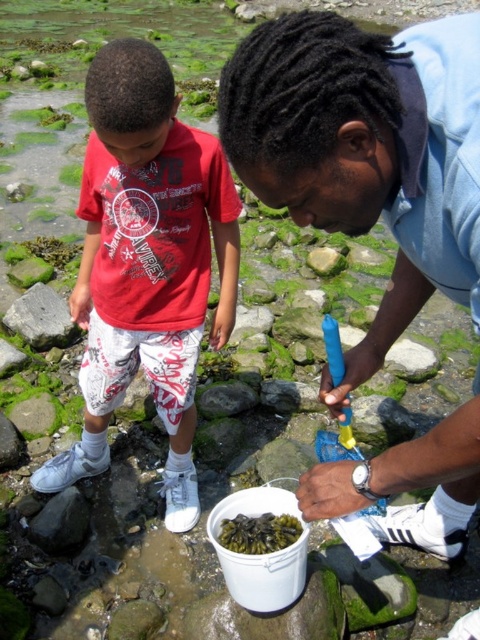
Is point (135, 186) behind point (224, 528)?

Yes, it is behind point (224, 528).

Between matte red t-shirt at left and green seaweed at lower center, which one has more height?

Standing taller between the two is matte red t-shirt at left.

What do you see at coordinates (146, 264) in the screenshot? This screenshot has height=640, width=480. I see `matte red t-shirt at left` at bounding box center [146, 264].

You are a GUI agent. You are given a task and a screenshot of the screen. Output one action in this format:
    pyautogui.click(x=<x>, y=<y>)
    Task: Click on the matte red t-shirt at left
    The width and height of the screenshot is (480, 640).
    Given the screenshot: What is the action you would take?
    pyautogui.click(x=146, y=264)

Is point (439, 180) farther from camera compared to point (269, 545)?

No, (439, 180) is closer to viewer.

Is point (238, 108) farther from camera compared to point (240, 522)?

No, it is not.

Locate an element on the screen. blue plastic bucket at center is located at coordinates (365, 150).

Is point (108, 387) positioned before point (40, 291)?

Yes, it is.

Consider the image. Between matte red t-shirt at left and gray rock at left, which one has more height?

matte red t-shirt at left is taller.

Is point (206, 179) positioned before point (64, 340)?

Yes, point (206, 179) is closer to viewer.

Locate an element on the screen. Image resolution: width=480 pixels, height=640 pixels. matte red t-shirt at left is located at coordinates (146, 264).